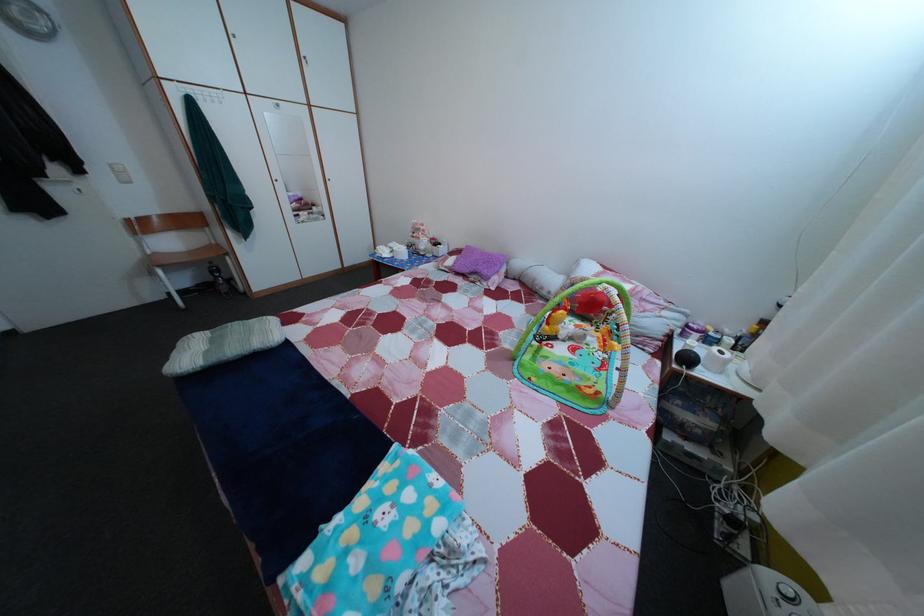
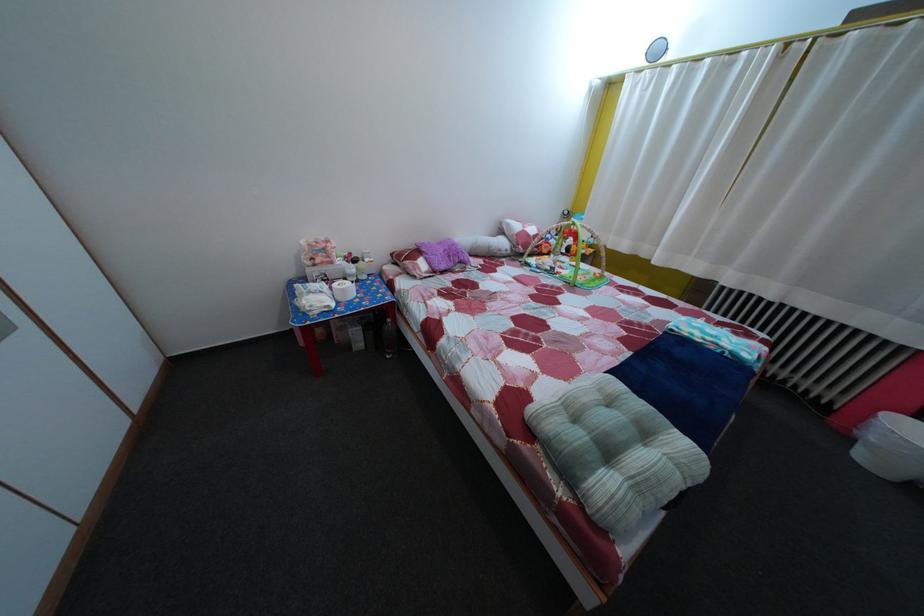
Locate, in the second image, the point that corresponds to the point at 325,363 in the first image.

(601, 379)